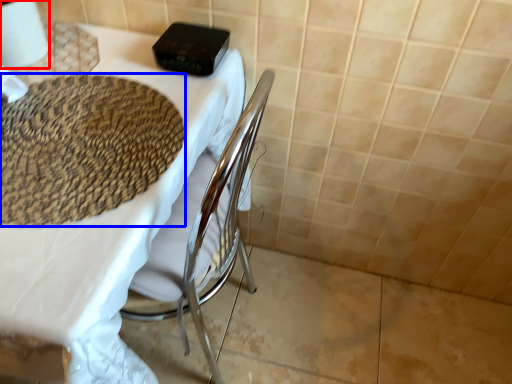
Question: Which point is closer to the camera, toilet paper (highlighted by a red box) or mat (highlighted by a blue box)?

Choices:
 (A) toilet paper
 (B) mat

Answer: (B)